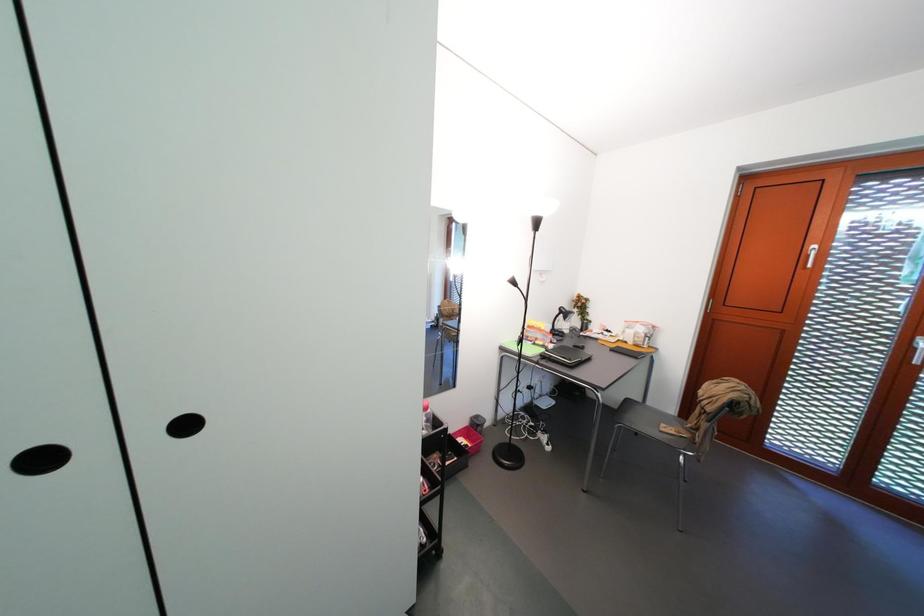
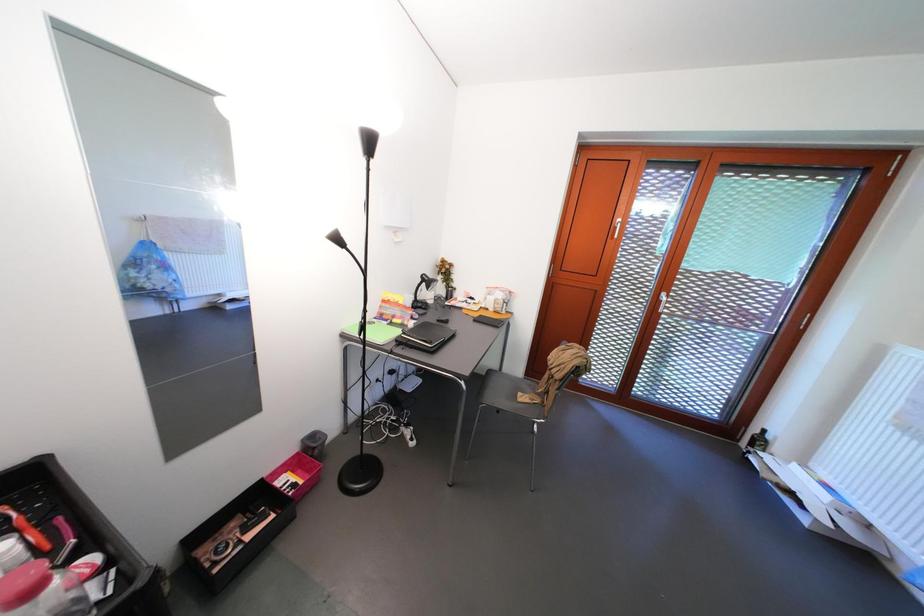
The images are taken continuously from a first-person perspective. In which direction are you moving?

The movement direction of the cameraman is right, forward.